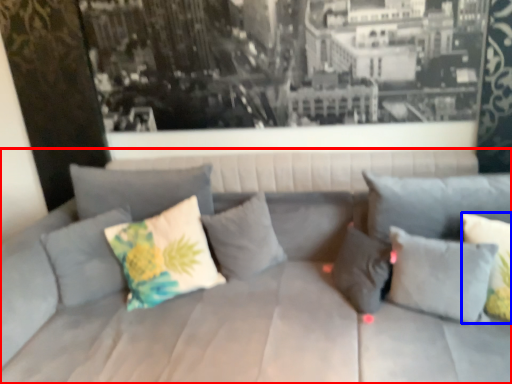
Question: Which object is further to the camera taking this photo, studio couch (highlighted by a red box) or pillow (highlighted by a blue box)?

Choices:
 (A) studio couch
 (B) pillow

Answer: (B)